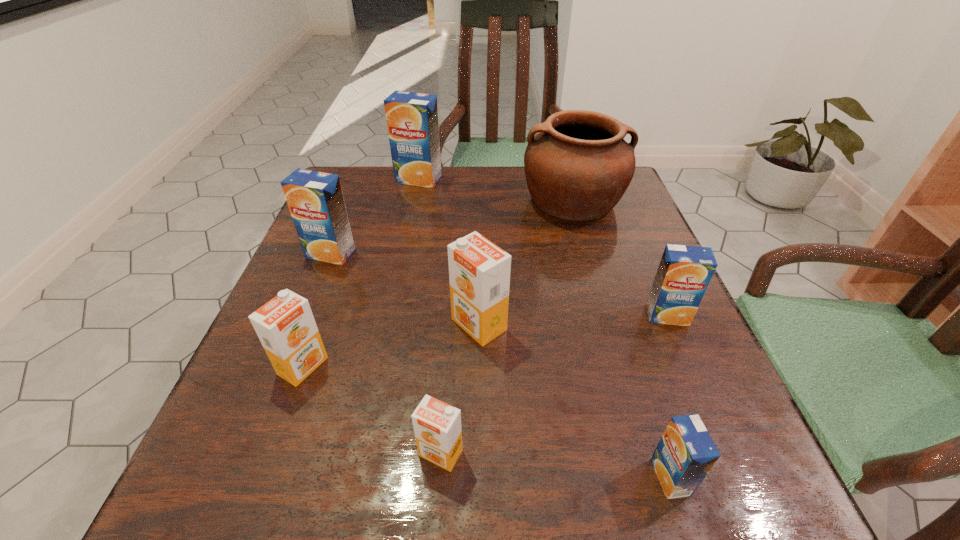
Find the location of a particular element. the fifth orange juice from right to left is located at coordinates (412, 118).

Where is `the tallest orange juice`? the tallest orange juice is located at coordinates (412, 118).

This screenshot has height=540, width=960. What are the coordinates of `reddish pottery` in the screenshot? It's located at (578, 167).

Find the location of a particular element. The image size is (960, 540). the sixth nearest orange juice is located at coordinates (315, 199).

Where is `the sixth nearest object`? The image size is (960, 540). the sixth nearest object is located at coordinates (315, 199).

Identify the location of the biggest orange orange juice. (479, 271).

Identify the location of the second smallest blue orange_juice. (684, 273).

In order to click on the rightmost blue orange_juice in this screenshot , I will do `click(684, 273)`.

At what (x,y) coordinates should I click in order to perform the action: click on the leftmost orange orange juice. Please return your answer as a coordinate pair (x, y). This screenshot has height=540, width=960. Looking at the image, I should click on (285, 325).

The height and width of the screenshot is (540, 960). Find the location of `the smallest blue orange_juice`. the smallest blue orange_juice is located at coordinates (685, 454).